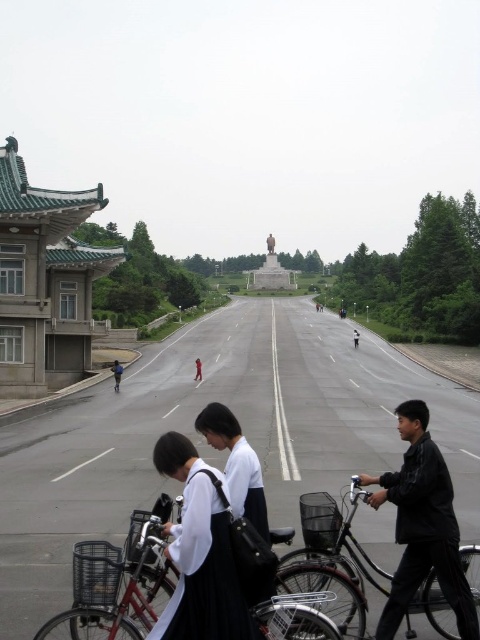
Question: Is dark blue uniform at center to the left of red fabric person at center from the viewer's perspective?

Choices:
 (A) no
 (B) yes

Answer: (B)

Question: Is silver metallic bicycle at lower center to the right of black matte person at center from the viewer's perspective?

Choices:
 (A) no
 (B) yes

Answer: (A)

Question: Which object is closer to the camera taking this photo?

Choices:
 (A) black matte bicycle at lower right
 (B) dark blue uniform at center

Answer: (A)

Question: Estimate the real-world distances between objects in this image. Which object is farther from the black matte person at center?

Choices:
 (A) black matte bicycle at lower right
 (B) dark blue uniform at center
 (C) silver metallic bicycle at lower center

Answer: (C)

Question: Is silver metallic bicycle at lower center in front of black matte bicycle at lower right?

Choices:
 (A) yes
 (B) no

Answer: (A)

Question: Which of these objects is positioned closest to the silver metallic bicycle at lower center?

Choices:
 (A) black matte jacket at lower right
 (B) dark blue uniform at center
 (C) black matte bicycle at lower right

Answer: (C)